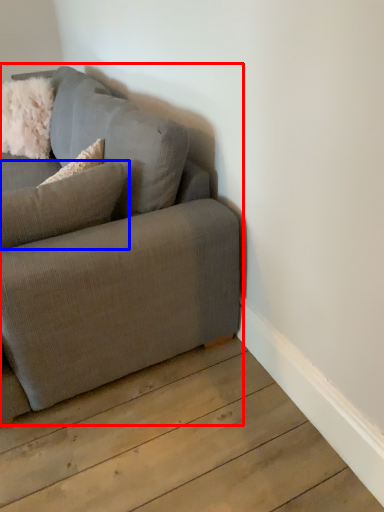
Question: Which object is closer to the camera taking this photo, studio couch (highlighted by a red box) or pillow (highlighted by a blue box)?

Choices:
 (A) studio couch
 (B) pillow

Answer: (A)